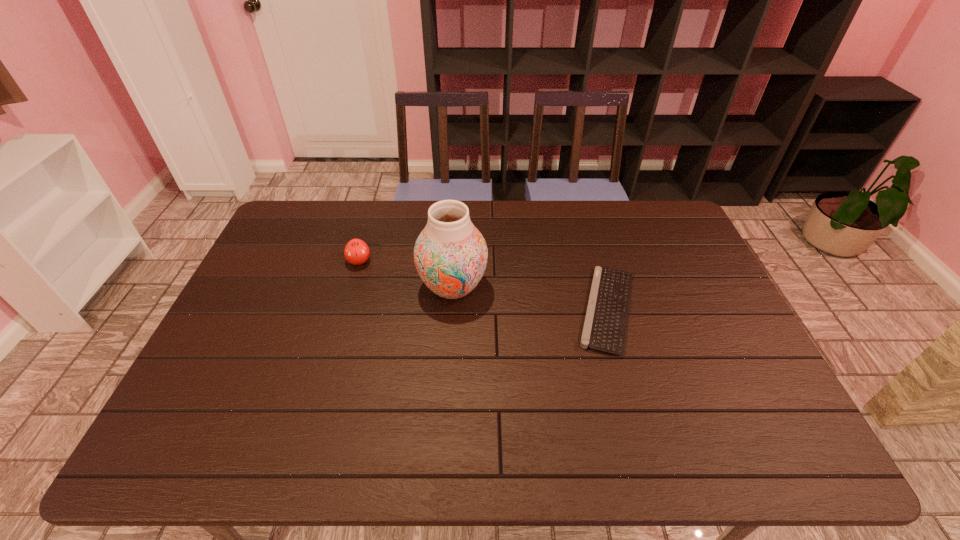
Where is `vase`? This screenshot has height=540, width=960. vase is located at coordinates (450, 254).

Where is `the second object from left to right`? the second object from left to right is located at coordinates point(450,254).

The height and width of the screenshot is (540, 960). I want to click on the leftmost object, so click(x=356, y=252).

You are a GUI agent. You are given a task and a screenshot of the screen. Output one action in this format:
    pyautogui.click(x=<x>, y=<y>)
    Task: Click on the second tallest object
    This screenshot has height=540, width=960.
    Given the screenshot: What is the action you would take?
    pyautogui.click(x=356, y=252)

The height and width of the screenshot is (540, 960). I want to click on the rightmost object, so click(x=605, y=326).

Where is `the shortest object`? Image resolution: width=960 pixels, height=540 pixels. the shortest object is located at coordinates (605, 326).

Image resolution: width=960 pixels, height=540 pixels. Find the location of `free spot located 0.340m on the front of the tallest object`. free spot located 0.340m on the front of the tallest object is located at coordinates (444, 422).

I want to click on vacant point located 0.160m on the back of the second tallest object, so click(x=371, y=224).

What are the coordinates of `vacant space situated 0.200m on the left of the computer keyboard` in the screenshot? It's located at (504, 309).

The image size is (960, 540). I want to click on free region at the far edge of the desktop, so click(x=518, y=230).